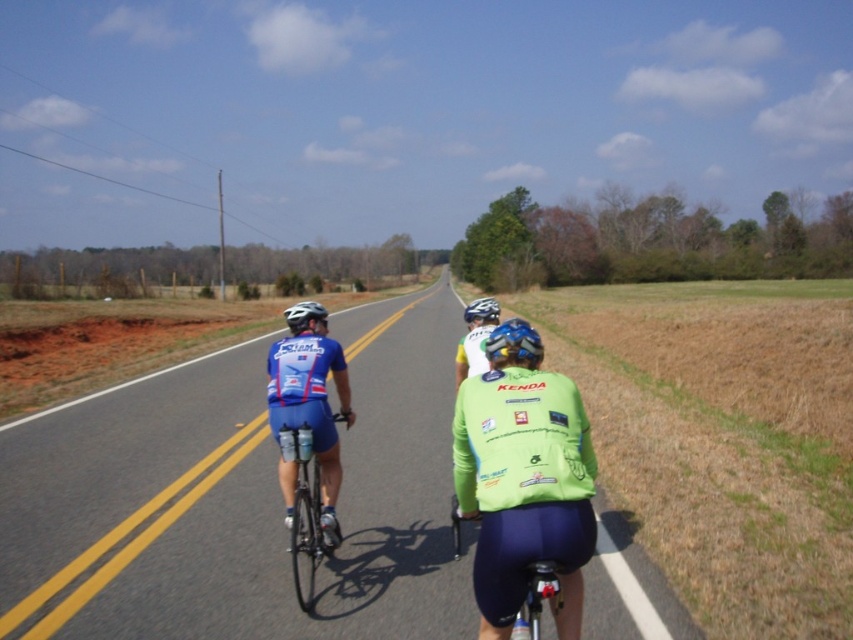
You are a photographer planning to take a portrait of the cyclists. You want to focus on the light green jersey at center and the blue matte helmet at center. Which object should you adjust your camera settings for if you want to capture details of the thinner item?

The light green jersey at center is thinner than the blue matte helmet at center, so you should adjust your camera settings for the light green jersey at center to capture its details properly.

You are a photographer positioned at the origin point of the image. You want to capture a photo of the green matte jersey at center. What are the coordinates where you should aim your camera?

The green matte jersey at center is located at point (523, 486), so you should aim your camera at those coordinates to capture it.